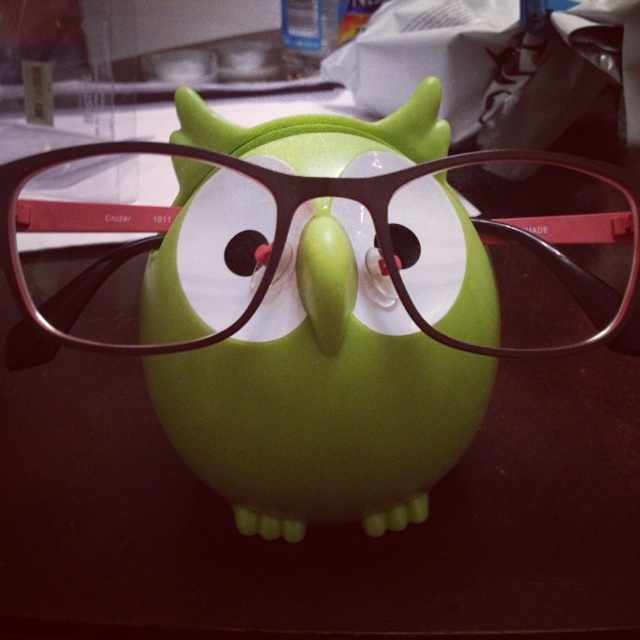
Question: Which object is closer to the camera taking this photo?

Choices:
 (A) green matte/soft toy at center
 (B) matte black glasses at center
 (C) matte black eye at center

Answer: (B)

Question: Is green matte/soft toy at center thinner than matte black glasses at center?

Choices:
 (A) no
 (B) yes

Answer: (B)

Question: Is green matte/soft toy at center to the left of matte black glasses at center from the viewer's perspective?

Choices:
 (A) no
 (B) yes

Answer: (B)

Question: Does green matte/soft toy at center have a greater width compared to matte black eye at center?

Choices:
 (A) yes
 (B) no

Answer: (A)

Question: Which point appears closest to the camera in this image?

Choices:
 (A) (356, 196)
 (B) (260, 241)

Answer: (A)

Question: Among these objects, which one is nearest to the camera?

Choices:
 (A) green matte/soft toy at center
 (B) matte black glasses at center

Answer: (B)